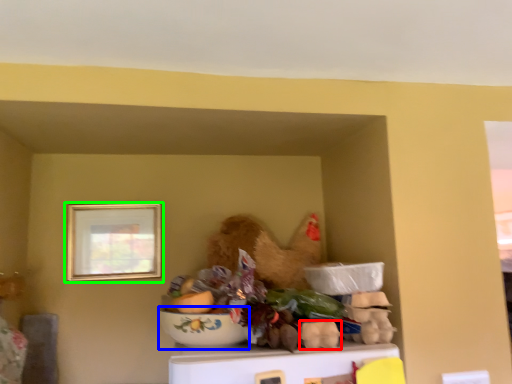
Question: Based on their relative distances, which object is farther from food (highlighted by a red box)? Choose from bowl (highlighted by a blue box) and picture frame (highlighted by a green box).

Choices:
 (A) bowl
 (B) picture frame

Answer: (B)